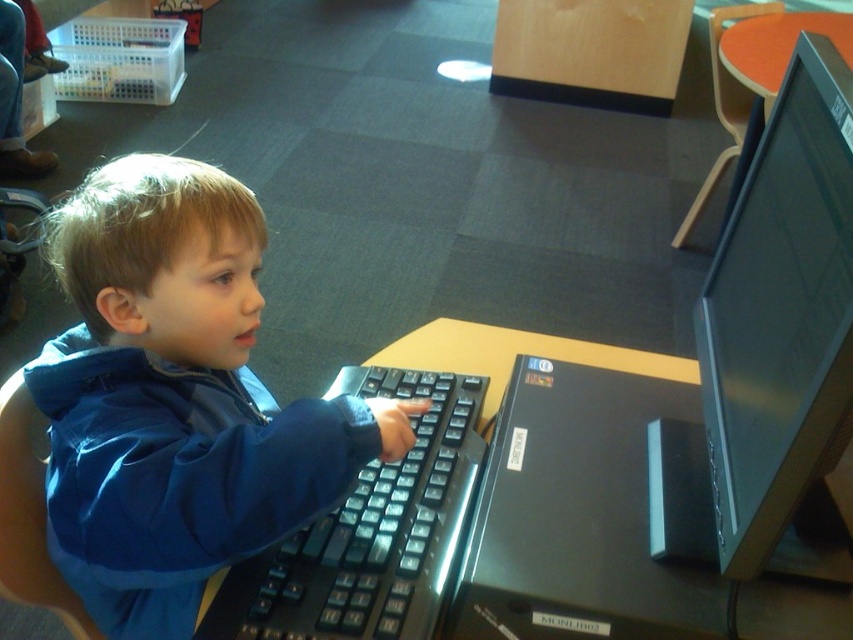
Question: Which point is farther to the camera?

Choices:
 (A) (96, 456)
 (B) (759, 499)

Answer: (A)

Question: Is metallic silver monitor at upper right bigger than black plastic keyboard at center?

Choices:
 (A) yes
 (B) no

Answer: (A)

Question: Which of these objects is positioned farthest from the metallic silver monitor at upper right?

Choices:
 (A) brown wooden table at center
 (B) black plastic keyboard at center
 (C) blue matte jacket at center

Answer: (C)

Question: Does metallic silver monitor at upper right have a smaller size compared to brown wooden table at center?

Choices:
 (A) no
 (B) yes

Answer: (A)

Question: Among these objects, which one is farthest from the camera?

Choices:
 (A) brown wooden table at center
 (B) metallic silver monitor at upper right
 (C) black plastic keyboard at center

Answer: (A)

Question: Can you confirm if metallic silver monitor at upper right is positioned to the right of black plastic keyboard at center?

Choices:
 (A) no
 (B) yes

Answer: (B)